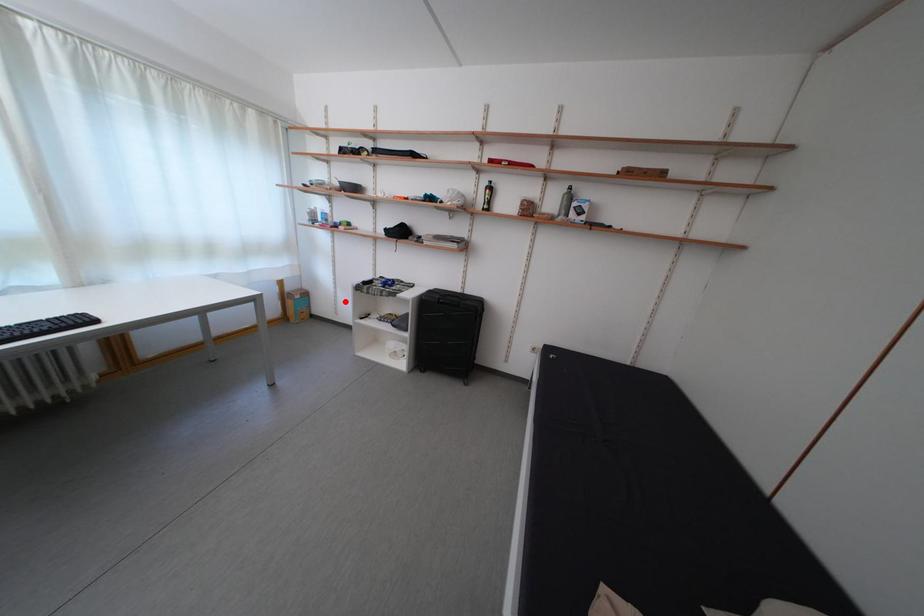
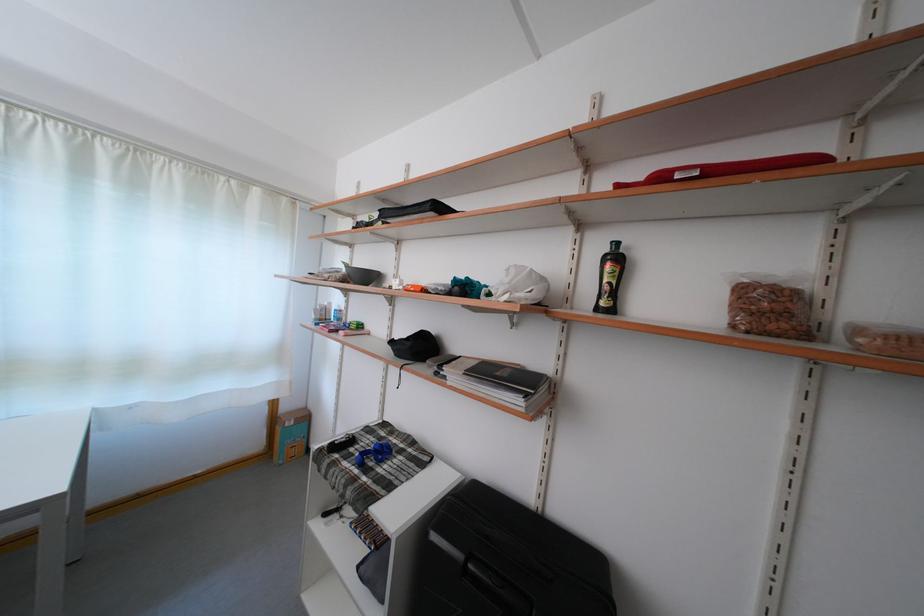
Question: I am providing you with two images of the same scene from different viewpoints. A red point is shown in image1. For the corresponding object point in image2, is it positioned nearer or farther from the camera?

Choices:
 (A) Nearer
 (B) Farther

Answer: (B)